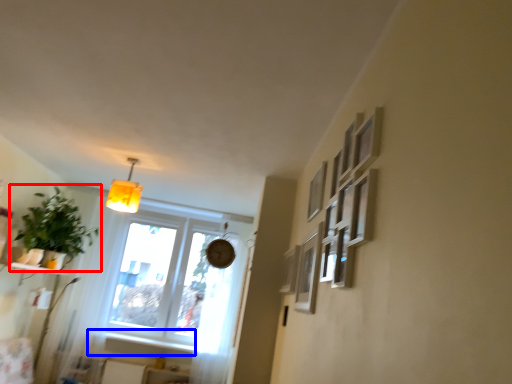
Question: Which object appears farthest to the camera in this image, houseplant (highlighted by a red box) or window sill (highlighted by a blue box)?

Choices:
 (A) houseplant
 (B) window sill

Answer: (B)